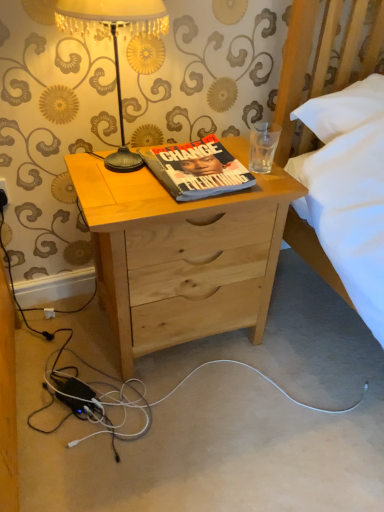
Where is `natural wood nightstand at center`? natural wood nightstand at center is located at coordinates (180, 256).

This screenshot has width=384, height=512. What do you see at coordinates (197, 169) in the screenshot?
I see `hardcover book at center` at bounding box center [197, 169].

You are a GUI agent. You are given a task and a screenshot of the screen. Output one action in this format:
    pyautogui.click(x=<x>, y=<y>)
    Task: Click on the hardcover book at center
    The image size is (384, 512).
    Given the screenshot: What is the action you would take?
    pyautogui.click(x=197, y=169)

Identify the location of natural wood nightstand at center. This screenshot has height=512, width=384. (180, 256).

You are a GUI agent. You are given a task and a screenshot of the screen. Output one action in this format:
    pyautogui.click(x=<x>, y=<y>)
    Task: Click on the lamp lying in front of the hardcover book at center
    The image size is (384, 512).
    Given the screenshot: What is the action you would take?
    pyautogui.click(x=114, y=44)

Considering the sizes of objects hardcover book at center and gold textured lampshade at upper left in the image provided, who is wider, hardcover book at center or gold textured lampshade at upper left?

Wider between the two is hardcover book at center.

Is hardcover book at center at the right side of gold textured lampshade at upper left?

Indeed, hardcover book at center is positioned on the right side of gold textured lampshade at upper left.

Can we say gold textured lampshade at upper left lies outside natural wood nightstand at center?

Yes.

In the scene shown: Could you tell me if gold textured lampshade at upper left is turned towards natural wood nightstand at center?

No, gold textured lampshade at upper left is not aimed at natural wood nightstand at center.

Are gold textured lampshade at upper left and natural wood nightstand at center beside each other?

No, gold textured lampshade at upper left is not touching natural wood nightstand at center.

Is gold textured lampshade at upper left facing towards hardcover book at center?

No, gold textured lampshade at upper left is not aimed at hardcover book at center.

Is gold textured lampshade at upper left directly adjacent to hardcover book at center?

No, gold textured lampshade at upper left is not beside hardcover book at center.

Does gold textured lampshade at upper left have a smaller size compared to hardcover book at center?

Incorrect, gold textured lampshade at upper left is not smaller in size than hardcover book at center.

Considering the sizes of gold textured lampshade at upper left and hardcover book at center in the image, is gold textured lampshade at upper left taller or shorter than hardcover book at center?

gold textured lampshade at upper left is taller than hardcover book at center.

Would you consider hardcover book at center to be distant from natural wood nightstand at center?

No, there isn't a large distance between hardcover book at center and natural wood nightstand at center.

Identify the location of desk in front of the hardcover book at center. This screenshot has width=384, height=512. (180, 256).

From the image's perspective, relative to natural wood nightstand at center, is hardcover book at center above or below?

hardcover book at center is above natural wood nightstand at center.

Is hardcover book at center oriented away from natural wood nightstand at center?

hardcover book at center does not have its back to natural wood nightstand at center.

Which of these two, natural wood nightstand at center or hardcover book at center, is bigger?

natural wood nightstand at center.

Considering their positions, is natural wood nightstand at center located in front of or behind hardcover book at center?

Clearly, natural wood nightstand at center is in front of hardcover book at center.

Looking at this image, is the surface of natural wood nightstand at center in direct contact with hardcover book at center?

natural wood nightstand at center and hardcover book at center are not in contact.

Is natural wood nightstand at center to the right of gold textured lampshade at upper left from the viewer's perspective?

Correct, you'll find natural wood nightstand at center to the right of gold textured lampshade at upper left.

Is gold textured lampshade at upper left a part of natural wood nightstand at center?

No, natural wood nightstand at center does not contain gold textured lampshade at upper left.

In the scene shown: Does natural wood nightstand at center have a lesser height compared to gold textured lampshade at upper left?

No, natural wood nightstand at center is not shorter than gold textured lampshade at upper left.

Is natural wood nightstand at center bigger than gold textured lampshade at upper left?

Yes.

Locate an element on the screen. book that is under the gold textured lampshade at upper left (from a real-world perspective) is located at coordinates (197, 169).

Locate an element on the screen. The height and width of the screenshot is (512, 384). lamp located above the natural wood nightstand at center (from a real-world perspective) is located at coordinates (114, 44).

When comparing their distances from gold textured lampshade at upper left, does hardcover book at center or natural wood nightstand at center seem further?

Among the two, natural wood nightstand at center is located further to gold textured lampshade at upper left.

Considering their positions, is hardcover book at center positioned further to natural wood nightstand at center than gold textured lampshade at upper left?

gold textured lampshade at upper left is further to natural wood nightstand at center.

Based on their spatial positions, is gold textured lampshade at upper left or natural wood nightstand at center closer to hardcover book at center?

The object closer to hardcover book at center is natural wood nightstand at center.

Considering their positions, is natural wood nightstand at center positioned closer to gold textured lampshade at upper left than hardcover book at center?

hardcover book at center is closer to gold textured lampshade at upper left.

Based on their spatial positions, is natural wood nightstand at center or gold textured lampshade at upper left further from hardcover book at center?

gold textured lampshade at upper left is positioned further to the anchor hardcover book at center.

Based on their spatial positions, is gold textured lampshade at upper left or hardcover book at center closer to natural wood nightstand at center?

Based on the image, hardcover book at center appears to be nearer to natural wood nightstand at center.

I want to click on book that lies between gold textured lampshade at upper left and natural wood nightstand at center from top to bottom, so click(x=197, y=169).